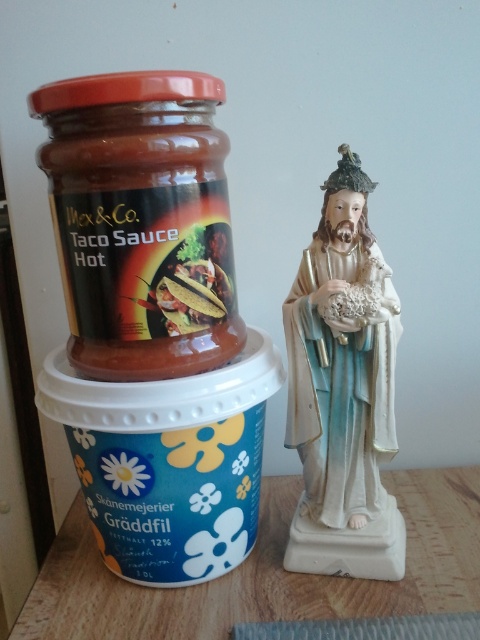
Question: Does matte glass jar at left lie in front of wooden table at center?

Choices:
 (A) no
 (B) yes

Answer: (B)

Question: Which point is closer to the camera taking this photo?

Choices:
 (A) (70, 90)
 (B) (279, 524)
 (C) (165, 256)

Answer: (A)

Question: Does wooden table at center have a lesser width compared to red plastic lid at upper left?

Choices:
 (A) no
 (B) yes

Answer: (A)

Question: Estimate the real-world distances between objects in this image. Which object is closer to the matte glass jar at left?

Choices:
 (A) wooden table at center
 (B) red plastic lid at upper left

Answer: (B)

Question: Among these points, which one is farthest from the camera?

Choices:
 (A) (137, 76)
 (B) (202, 176)
 (C) (469, 563)

Answer: (C)

Question: Is wooden table at center closer to the viewer compared to red plastic lid at upper left?

Choices:
 (A) no
 (B) yes

Answer: (A)